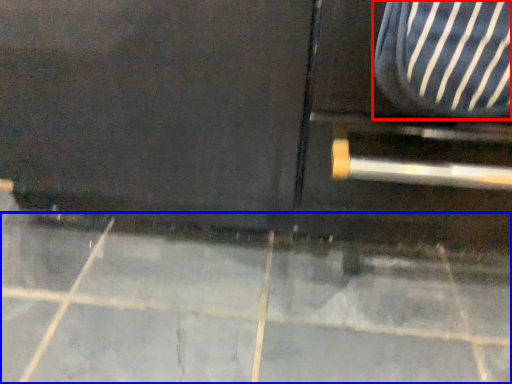
Question: Which point is closer to the camera, armchair (highlighted by a red box) or concrete (highlighted by a blue box)?

Choices:
 (A) armchair
 (B) concrete

Answer: (A)